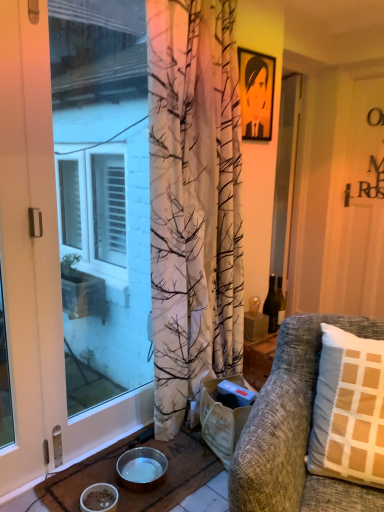
Question: Should I look upward or downward to see transparent glass screen door at center, which is the 1th screen door from back to front?

Choices:
 (A) up
 (B) down

Answer: (A)

Question: From a real-world perspective, is textured gray couch at right located higher than metallic silver bowl at lower center, which is counted as the 2th bowl, starting from the front?

Choices:
 (A) yes
 (B) no

Answer: (A)

Question: Can we say textured gray couch at right lies outside metallic silver bowl at lower center, which is counted as the 2th bowl, starting from the front?

Choices:
 (A) no
 (B) yes

Answer: (B)

Question: Does textured gray couch at right have a lesser height compared to metallic silver bowl at lower center, which is counted as the 2th bowl, starting from the front?

Choices:
 (A) no
 (B) yes

Answer: (A)

Question: Is textured gray couch at right thinner than metallic silver bowl at lower center, which is counted as the 2th bowl, starting from the front?

Choices:
 (A) yes
 (B) no

Answer: (B)

Question: Is textured gray couch at right next to metallic silver bowl at lower center, the first bowl from the back?

Choices:
 (A) yes
 (B) no

Answer: (B)

Question: Does textured gray couch at right have a larger size compared to metallic silver bowl at lower center, which is counted as the 2th bowl, starting from the front?

Choices:
 (A) no
 (B) yes

Answer: (B)

Question: Could you tell me if matte black picture frame at upper center is turned towards matte white door at left?

Choices:
 (A) no
 (B) yes

Answer: (A)

Question: Is matte black picture frame at upper center thinner than matte white door at left?

Choices:
 (A) yes
 (B) no

Answer: (A)

Question: Can you confirm if matte black picture frame at upper center is positioned to the right of matte white door at left?

Choices:
 (A) yes
 (B) no

Answer: (A)

Question: Does matte black picture frame at upper center have a lesser height compared to matte white door at left?

Choices:
 (A) no
 (B) yes

Answer: (B)

Question: Is matte black picture frame at upper center oriented away from matte white door at left?

Choices:
 (A) no
 (B) yes

Answer: (A)

Question: Is matte black picture frame at upper center in front of matte white door at left?

Choices:
 (A) no
 (B) yes

Answer: (A)

Question: From a real-world perspective, is white matte bowl at lower left, which ranks as the 2th bowl in back-to-front order, positioned over translucent glass bottle at center right based on gravity?

Choices:
 (A) no
 (B) yes

Answer: (A)